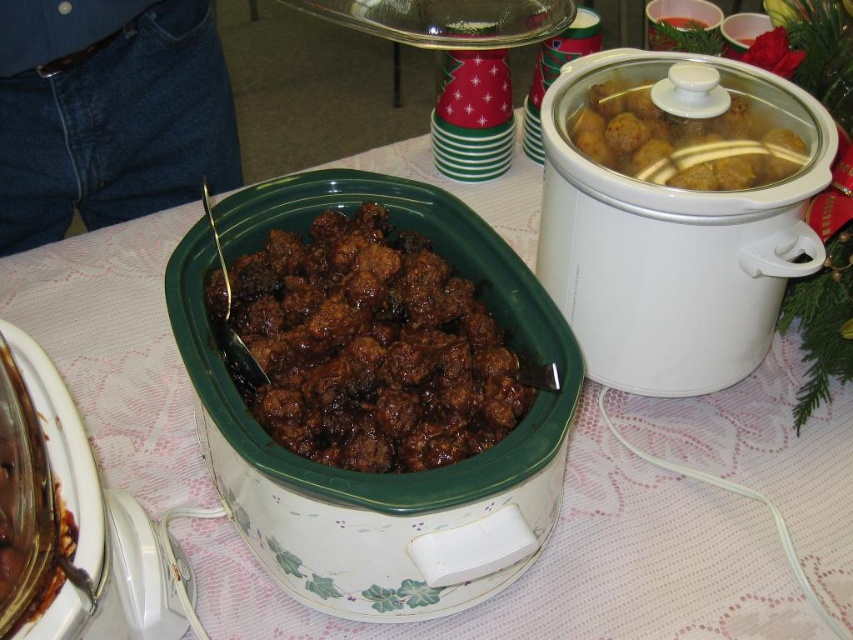
You are a guest at the holiday gathering and want to serve yourself some of the dish in the white glossy slow cooker at center. The serving spoon provided is 15 cm long. Considering the size of the translucent glass meatballs at center, will the spoon be long enough to reach the meatballs?

The white glossy slow cooker at center is larger in size than the translucent glass meatballs at center, but the spoon length is sufficient to reach the meatballs as they are smaller and the spoon can easily access them within the cooker.

You are a guest at the holiday gathering and want to choose the larger slow cooker between the white matte slow cooker at center right and the white glossy crock pot at center to serve yourself. Which one should you pick?

The white glossy crock pot at center is thicker than the white matte slow cooker at center right, so you should choose the white glossy crock pot at center for a larger serving.